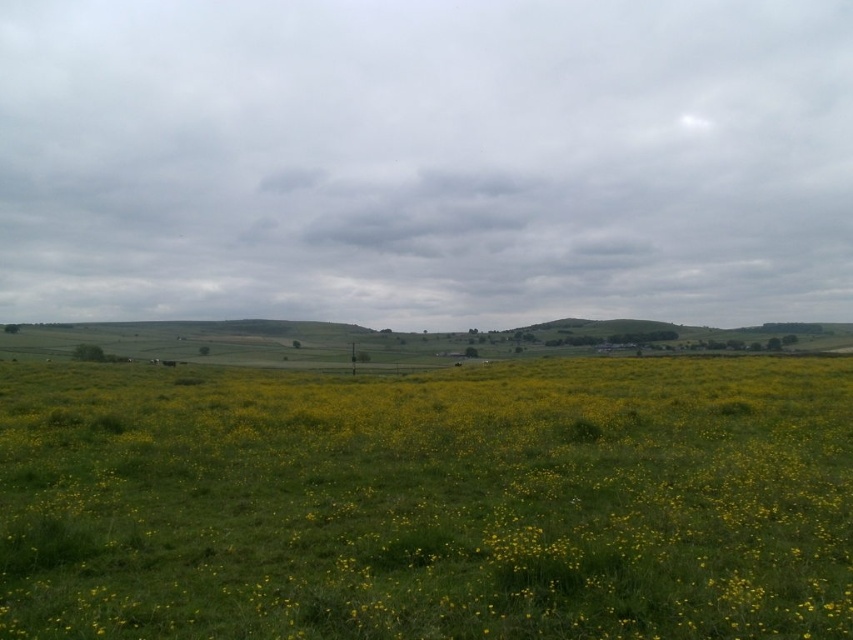
Question: Can you confirm if cloudy sky at center is positioned above yellow grass at center?

Choices:
 (A) yes
 (B) no

Answer: (A)

Question: Which of the following is the closest to the observer?

Choices:
 (A) (515, 506)
 (B) (68, 257)

Answer: (A)

Question: Does cloudy sky at center have a larger size compared to yellow grass at center?

Choices:
 (A) no
 (B) yes

Answer: (B)

Question: Is cloudy sky at center positioned in front of yellow grass at center?

Choices:
 (A) yes
 (B) no

Answer: (B)

Question: Which point is farther to the camera?

Choices:
 (A) (630, 573)
 (B) (402, 148)

Answer: (B)